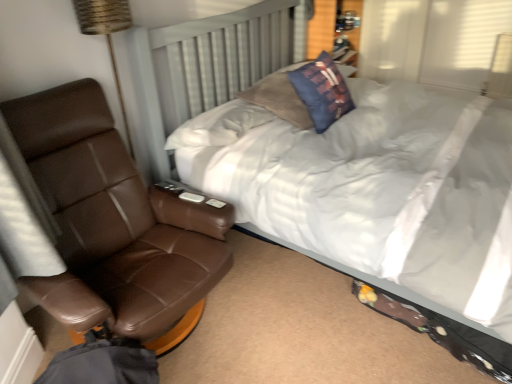
Question: Is blue fabric pillow at upper center completely or partially inside brown leather chair at left?

Choices:
 (A) yes
 (B) no

Answer: (B)

Question: Can you confirm if brown leather chair at left is bigger than blue fabric pillow at upper center?

Choices:
 (A) no
 (B) yes

Answer: (B)

Question: Can you confirm if brown leather chair at left is taller than blue fabric pillow at upper center?

Choices:
 (A) no
 (B) yes

Answer: (B)

Question: Is blue fabric pillow at upper center at the back of brown leather chair at left?

Choices:
 (A) yes
 (B) no

Answer: (B)

Question: Can you confirm if brown leather chair at left is positioned to the left of blue fabric pillow at upper center?

Choices:
 (A) yes
 (B) no

Answer: (A)

Question: Considering the relative sizes of brown leather chair at left and blue fabric pillow at upper center in the image provided, is brown leather chair at left wider than blue fabric pillow at upper center?

Choices:
 (A) no
 (B) yes

Answer: (B)

Question: From a real-world perspective, is blue fabric pillow at upper center under brown leather chair at left?

Choices:
 (A) yes
 (B) no

Answer: (B)

Question: Considering the relative positions of blue fabric pillow at upper center and brown leather chair at left in the image provided, is blue fabric pillow at upper center to the right of brown leather chair at left from the viewer's perspective?

Choices:
 (A) no
 (B) yes

Answer: (B)

Question: Is blue fabric pillow at upper center next to brown leather chair at left?

Choices:
 (A) yes
 (B) no

Answer: (B)

Question: Is blue fabric pillow at upper center oriented towards brown leather chair at left?

Choices:
 (A) yes
 (B) no

Answer: (B)

Question: Is blue fabric pillow at upper center behind brown leather chair at left?

Choices:
 (A) no
 (B) yes

Answer: (B)

Question: From the image's perspective, is blue fabric pillow at upper center over brown leather chair at left?

Choices:
 (A) yes
 (B) no

Answer: (A)

Question: Is blue fabric pillow at upper center completely or partially outside of white soft bed at center?

Choices:
 (A) yes
 (B) no

Answer: (B)